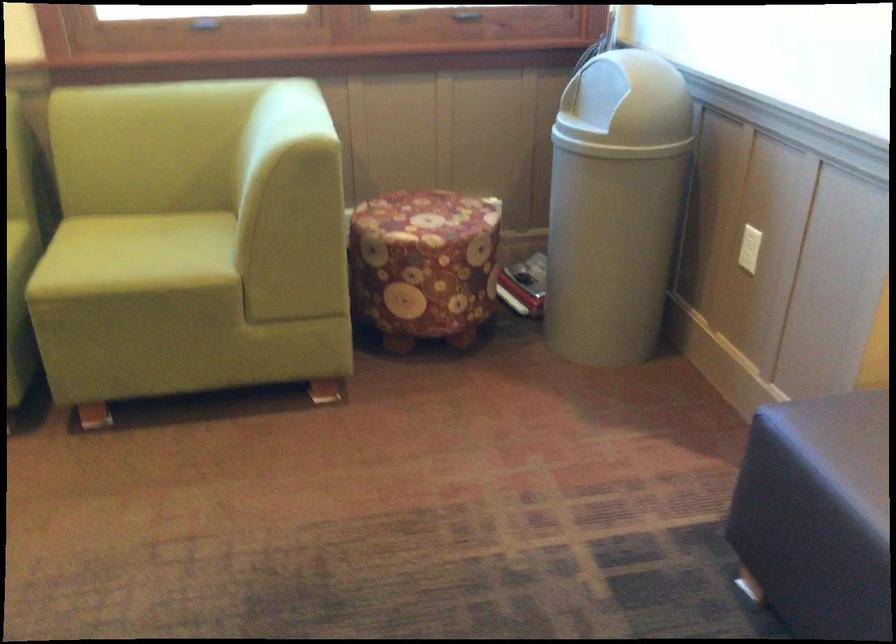
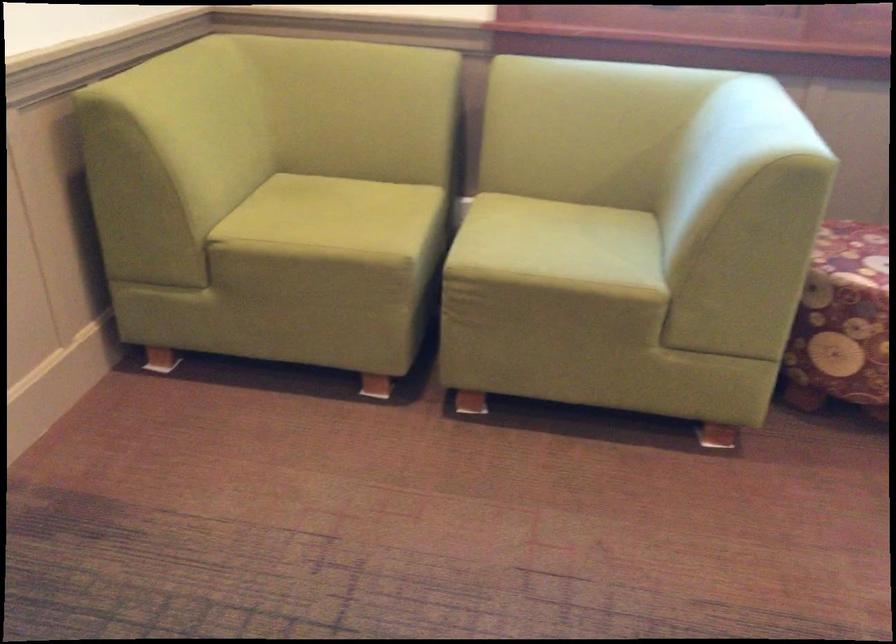
Question: Based on the continuous images, in which direction is the camera rotating? Reply with the corresponding letter.

Choices:
 (A) Left
 (B) Right
 (C) Up
 (D) Down

Answer: (A)